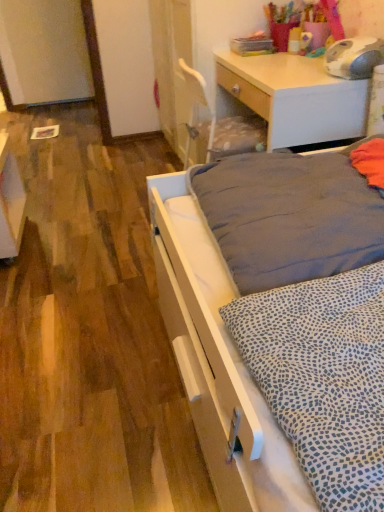
The image size is (384, 512). In order to click on free space in front of white glossy vanity at lower left in this screenshot , I will do `click(29, 280)`.